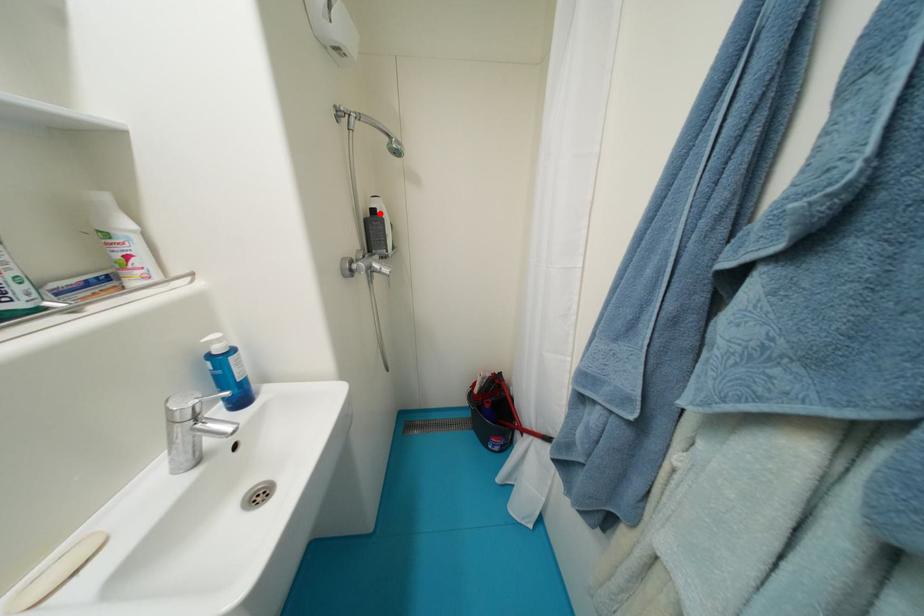
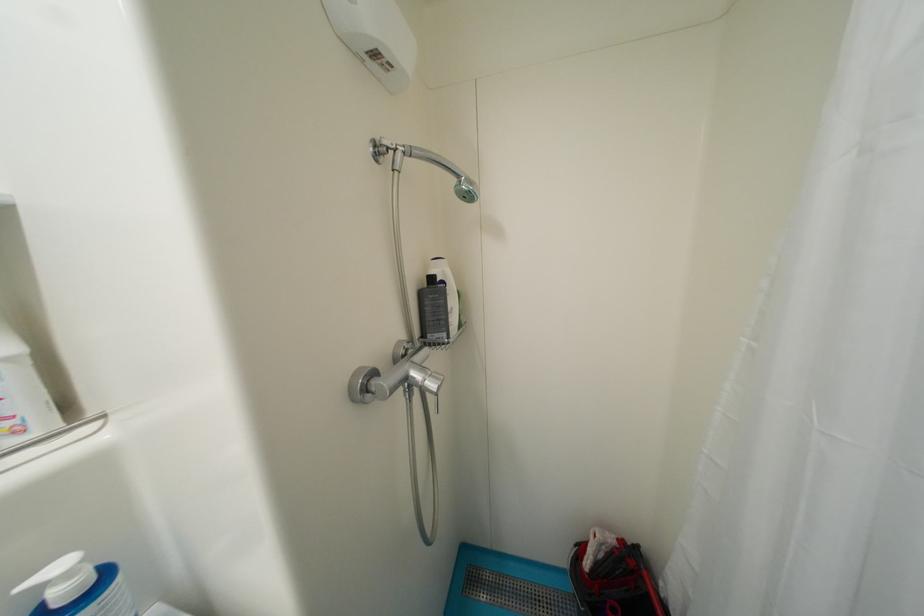
Locate, in the second image, the point that corresponds to the highlighted location in the first image.

(439, 281)